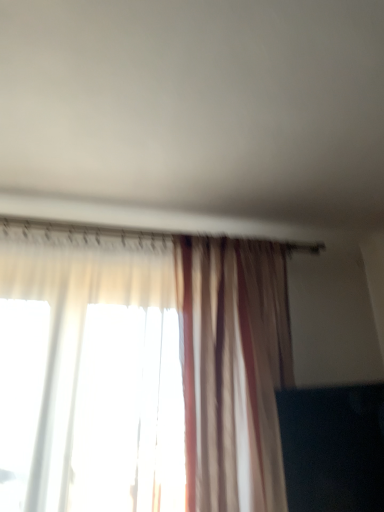
Locate an element on the screen. The height and width of the screenshot is (512, 384). translucent striped curtain at center is located at coordinates (233, 371).

What do you see at coordinates (233, 371) in the screenshot? I see `translucent striped curtain at center` at bounding box center [233, 371].

Where is `black glossy tv at lower right`? The height and width of the screenshot is (512, 384). black glossy tv at lower right is located at coordinates (333, 448).

In order to face black glossy tv at lower right, should I rotate leftwards or rightwards?

Turn right approximately 17.286 degrees to face it.

The height and width of the screenshot is (512, 384). Describe the element at coordinates (333, 448) in the screenshot. I see `black glossy tv at lower right` at that location.

At what (x,y) coordinates should I click in order to perform the action: click on translucent striped curtain at center. Please return your answer as a coordinate pair (x, y). Looking at the image, I should click on (233, 371).

Which is more to the left, translucent striped curtain at center or black glossy tv at lower right?

From the viewer's perspective, translucent striped curtain at center appears more on the left side.

Which object is closer to the camera taking this photo, translucent striped curtain at center or black glossy tv at lower right?

Positioned in front is translucent striped curtain at center.

Which is in front, point (269, 316) or point (348, 430)?

Point (348, 430)

From the image's perspective, would you say translucent striped curtain at center is shown under black glossy tv at lower right?

Actually, translucent striped curtain at center appears above black glossy tv at lower right in the image.

From a real-world perspective, is translucent striped curtain at center positioned above or below black glossy tv at lower right?

translucent striped curtain at center is situated higher than black glossy tv at lower right in the real world.

In terms of width, does translucent striped curtain at center look wider or thinner when compared to black glossy tv at lower right?

translucent striped curtain at center is wider than black glossy tv at lower right.

Which of these two, translucent striped curtain at center or black glossy tv at lower right, stands shorter?

black glossy tv at lower right is shorter.

Can you confirm if translucent striped curtain at center is smaller than black glossy tv at lower right?

Incorrect, translucent striped curtain at center is not smaller in size than black glossy tv at lower right.

From the picture: Is translucent striped curtain at center located outside black glossy tv at lower right?

Absolutely, translucent striped curtain at center is external to black glossy tv at lower right.

Is translucent striped curtain at center with black glossy tv at lower right?

translucent striped curtain at center is not next to black glossy tv at lower right, and they're not touching.

Is black glossy tv at lower right at the back of translucent striped curtain at center?

No, translucent striped curtain at center is not facing away from black glossy tv at lower right.

Measure the distance from translucent striped curtain at center to black glossy tv at lower right.

The distance of translucent striped curtain at center from black glossy tv at lower right is 10.27 inches.

Where is `dark that is behind the translucent striped curtain at center`? The image size is (384, 512). dark that is behind the translucent striped curtain at center is located at coordinates (333, 448).

In the image, is black glossy tv at lower right on the left side or the right side of translucent striped curtain at center?

Based on their positions, black glossy tv at lower right is located to the right of translucent striped curtain at center.

Which object is closer to the camera taking this photo, black glossy tv at lower right or translucent striped curtain at center?

translucent striped curtain at center is in front.

Which point is more forward, (327, 481) or (208, 403)?

The point (208, 403) is in front.

From the image's perspective, is black glossy tv at lower right below translucent striped curtain at center?

Yes.

From a real-world perspective, does black glossy tv at lower right sit lower than translucent striped curtain at center?

Yes, from a real-world perspective, black glossy tv at lower right is under translucent striped curtain at center.

Which of these two, black glossy tv at lower right or translucent striped curtain at center, is wider?

With larger width is translucent striped curtain at center.

Can you confirm if black glossy tv at lower right is taller than translucent striped curtain at center?

Incorrect, the height of black glossy tv at lower right is not larger of that of translucent striped curtain at center.

Can you confirm if black glossy tv at lower right is smaller than translucent striped curtain at center?

Yes.

Would you say black glossy tv at lower right is outside translucent striped curtain at center?

Actually, black glossy tv at lower right is within translucent striped curtain at center.

Is the surface of black glossy tv at lower right in direct contact with translucent striped curtain at center?

They are not placed beside each other.

Could you tell me if black glossy tv at lower right is turned towards translucent striped curtain at center?

Yes, black glossy tv at lower right is aimed at translucent striped curtain at center.

Identify the location of curtain in front of the black glossy tv at lower right. (233, 371).

This screenshot has height=512, width=384. I want to click on curtain located above the black glossy tv at lower right (from a real-world perspective), so click(x=233, y=371).

The image size is (384, 512). In the image, there is a translucent striped curtain at center. Identify the location of dark below it (from a real-world perspective). (333, 448).